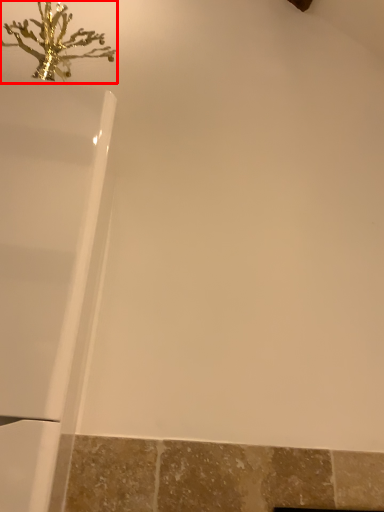
Question: Considering the relative positions of christmas decoration (annotated by the red box) and bathtub in the image provided, where is christmas decoration (annotated by the red box) located with respect to the staircase?

Choices:
 (A) right
 (B) left

Answer: (B)